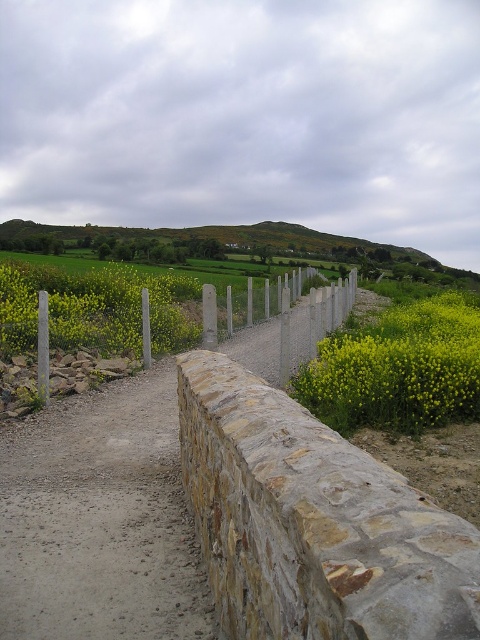
You are a hiker carrying a backpack and need to walk along the dusty gravel path at center while avoiding the yellow matte flowers at center. Can you walk through the path without stepping on the flowers?

The dusty gravel path at center is narrower than the yellow matte flowers at center, so you might have difficulty walking through without stepping on the flowers.

Based on the scene description, what can be found at the coordinates point (x=397, y=368)?

At point (x=397, y=368), there are yellow matte flowers at center.